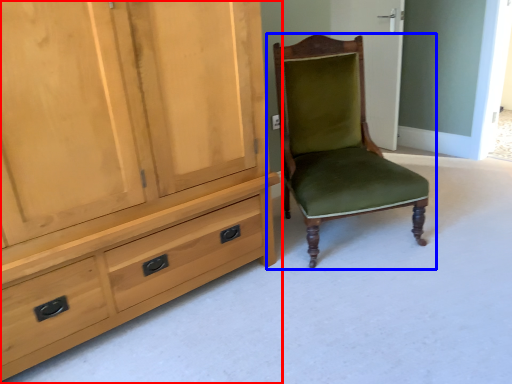
Question: Which of the following is the closest to the observer, cabinetry (highlighted by a red box) or chair (highlighted by a blue box)?

Choices:
 (A) cabinetry
 (B) chair

Answer: (A)